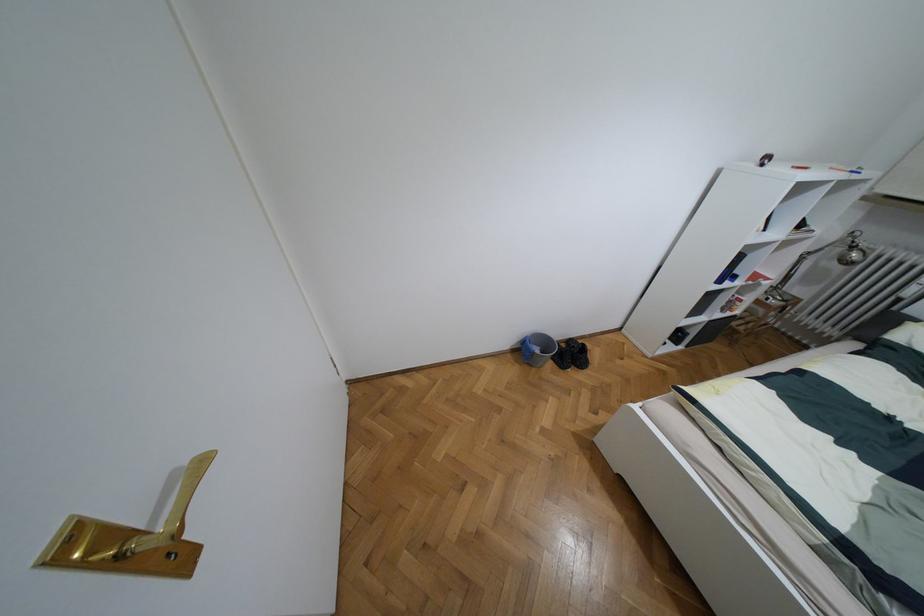
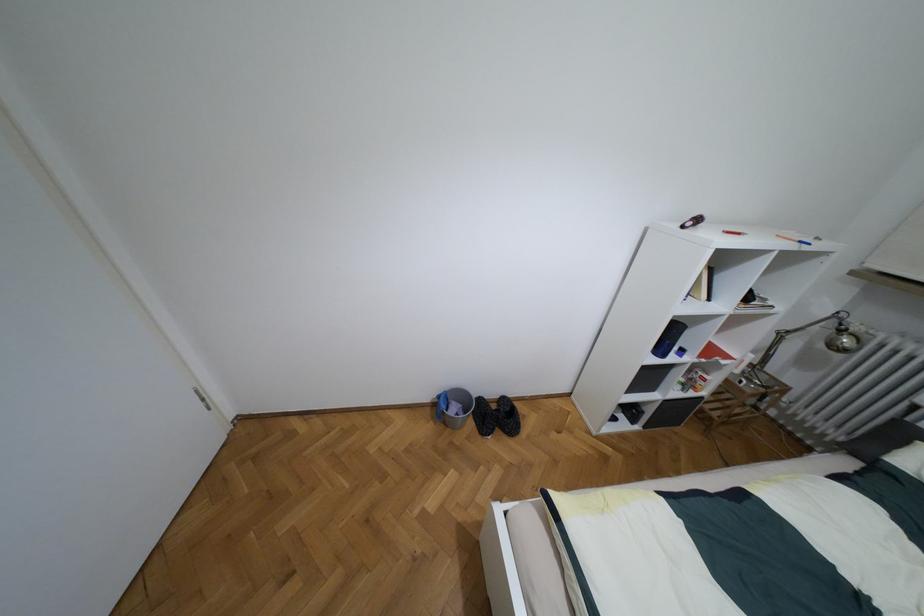
The point at [852,246] is marked in the first image. Where is the corresponding point in the second image?

(840, 330)